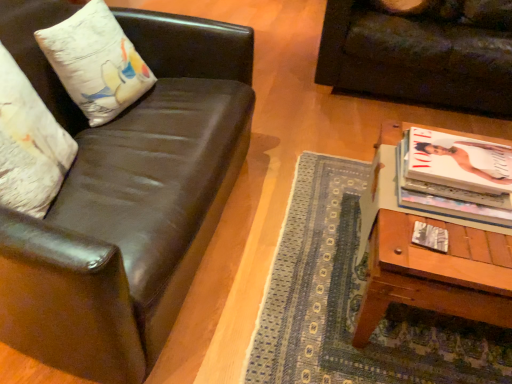
Locate an element on the screen. vacant space to the left of matte white magazine at right is located at coordinates (394, 241).